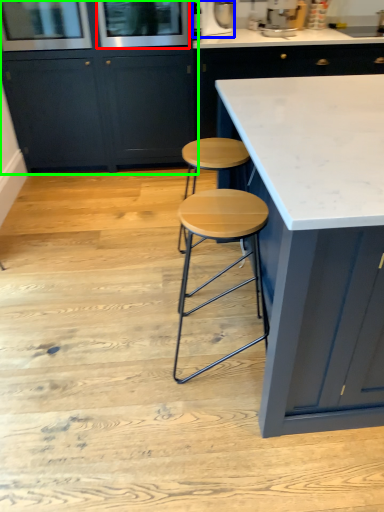
Question: Which object is the farthest from screen door (highlighted by a red box)? Choose among these: appliance (highlighted by a blue box) or cabinetry (highlighted by a green box).

Choices:
 (A) appliance
 (B) cabinetry

Answer: (A)